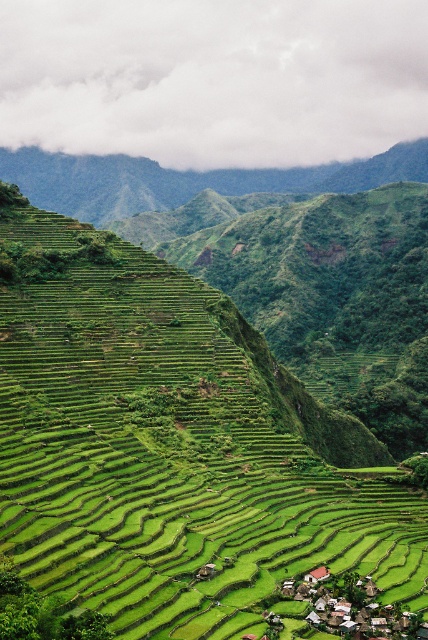
You are planning to take a photo of the green grassy terraces at center and the white wooden houses at bottom right. Which object is wider in the image?

The green grassy terraces at center are wider than the white wooden houses at bottom right.

You are standing at the origin point of the coordinate system and want to reach the green grassy terraces at center. What are the coordinates you need to move to?

The coordinates to reach the green grassy terraces at center are point (175, 451).